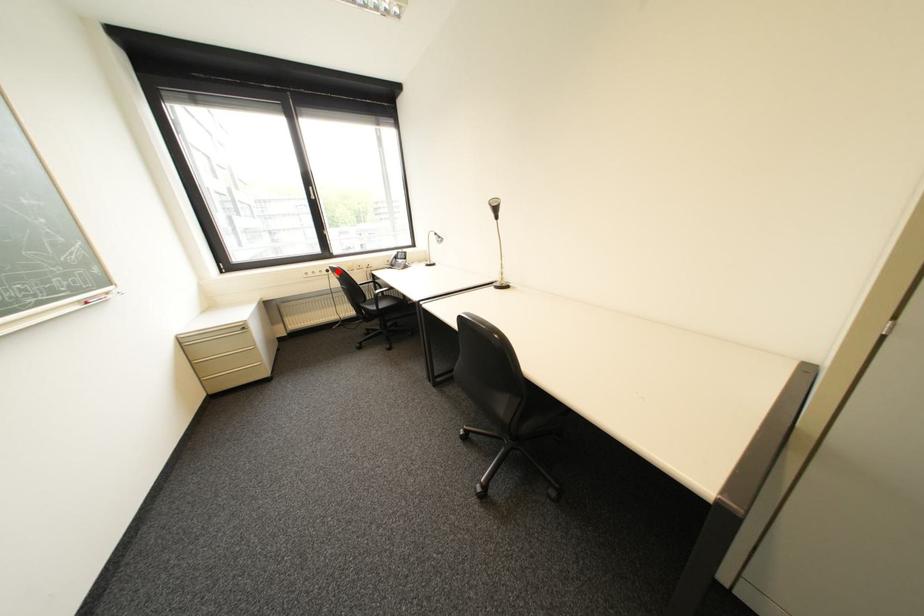
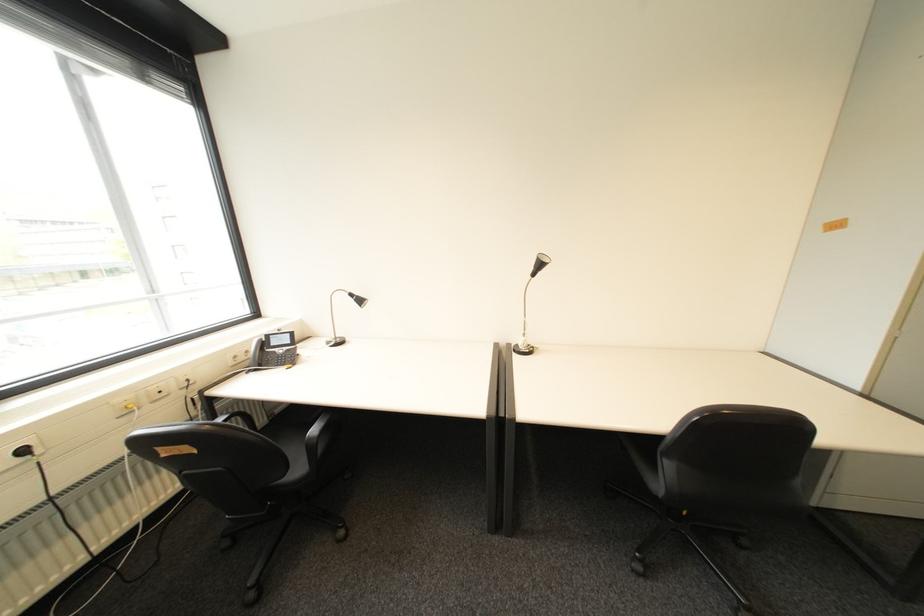
In the second image, find the point that corresponds to the highlighted location in the first image.

(34, 452)